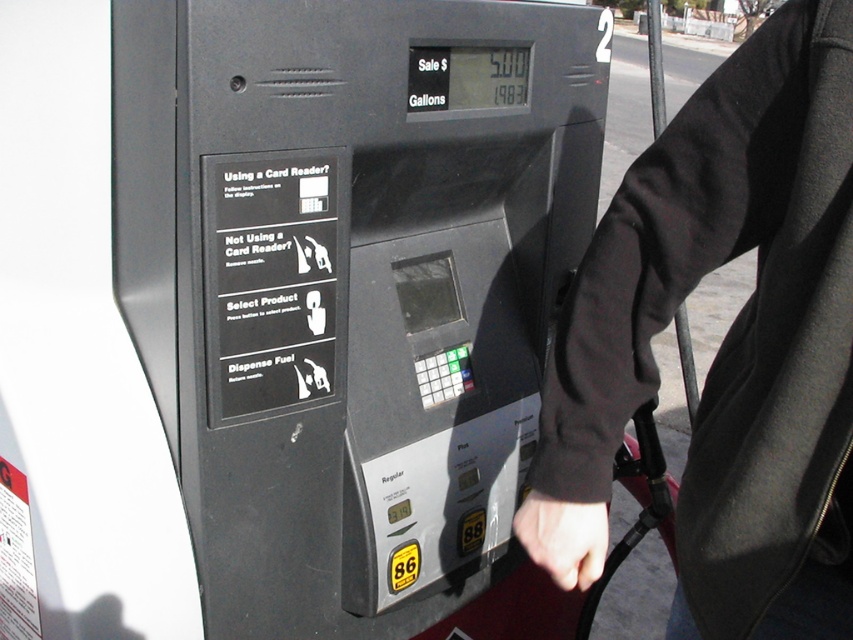
You are driving a car and need to refuel. You see the black plastic gas pump at center and the black fabric sleeve at upper right. Which object should you interact with to start refueling?

The black plastic gas pump at center is positioned on the left side of black fabric sleeve at upper right. To start refueling, you should interact with the black plastic gas pump at center as it is the actual fueling device.

You are a delivery driver who just arrived at the gas station. You need to refuel your truck. There is a black plastic gas pump at center and a black fabric sleeve at upper right in your view. Which object is closer to you?

The black plastic gas pump at center is closer to you because it is further to the viewer than the black fabric sleeve at upper right, meaning it appears nearer in your line of sight.

You are standing in front of the gas pump and see two points marked on it. The first point is at coordinates point [218,348] and the second point is at point [531,492]. Which point is closer to you?

Point [218,348] is closer to you because it is further to the camera than point [531,492].